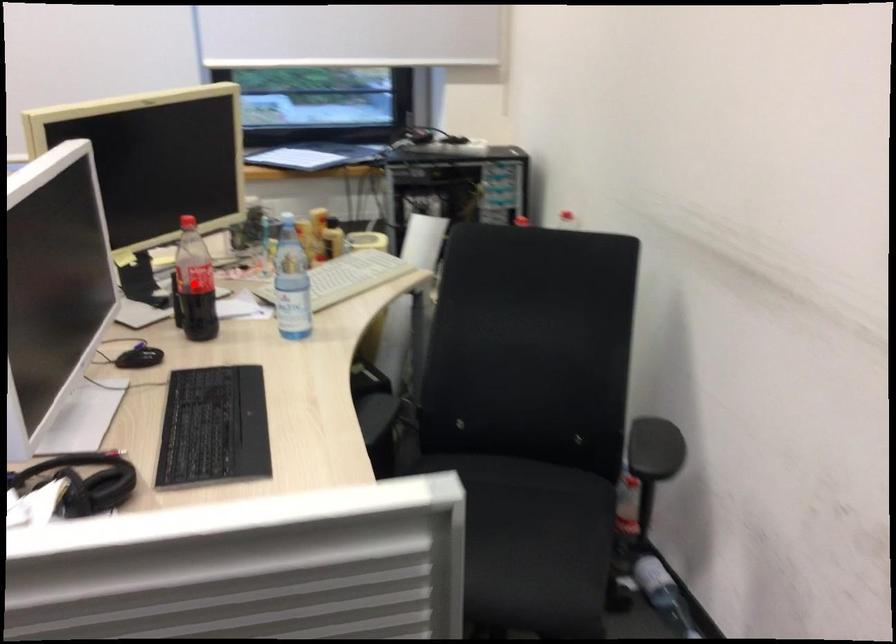
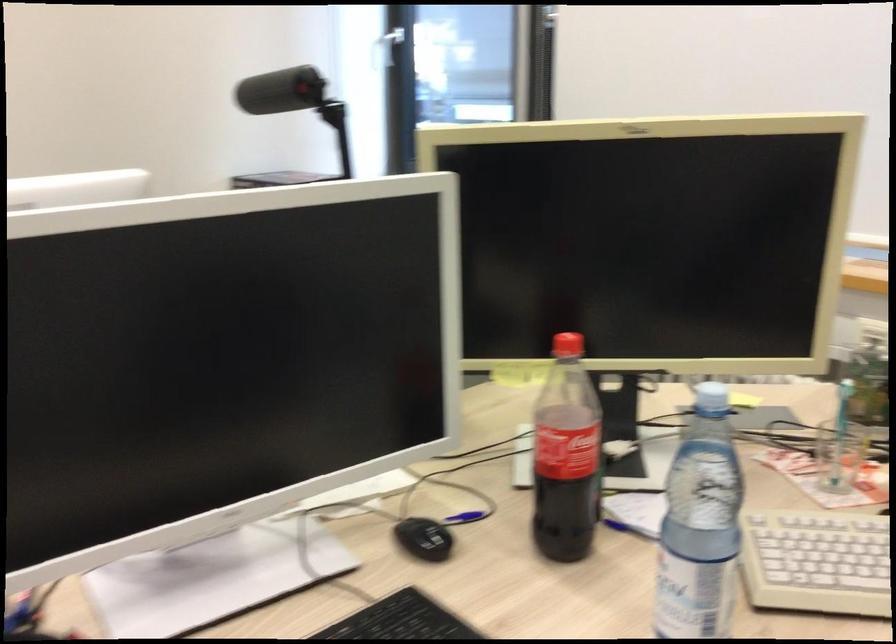
The point at the highlighted location is marked in the first image. Where is the corresponding point in the second image?

(565, 456)